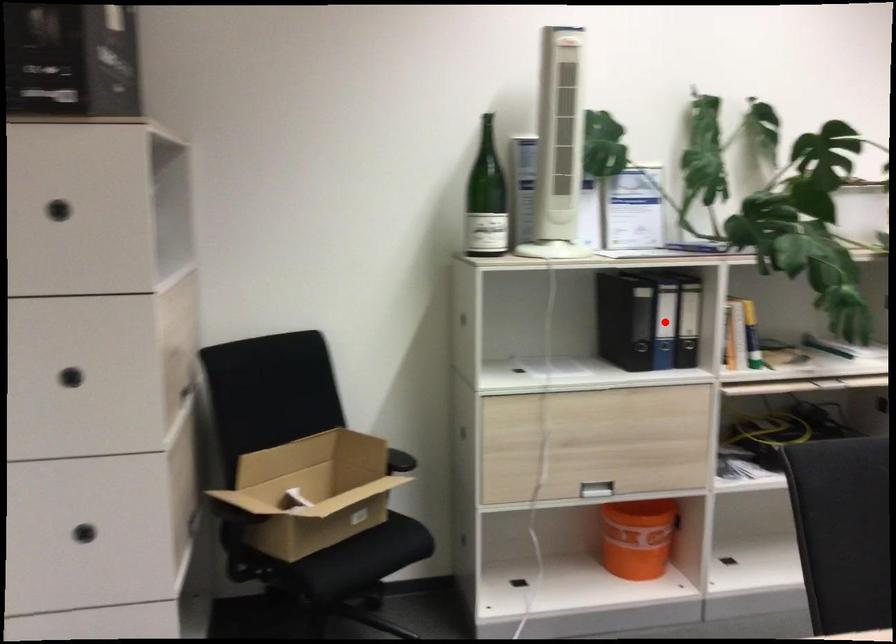
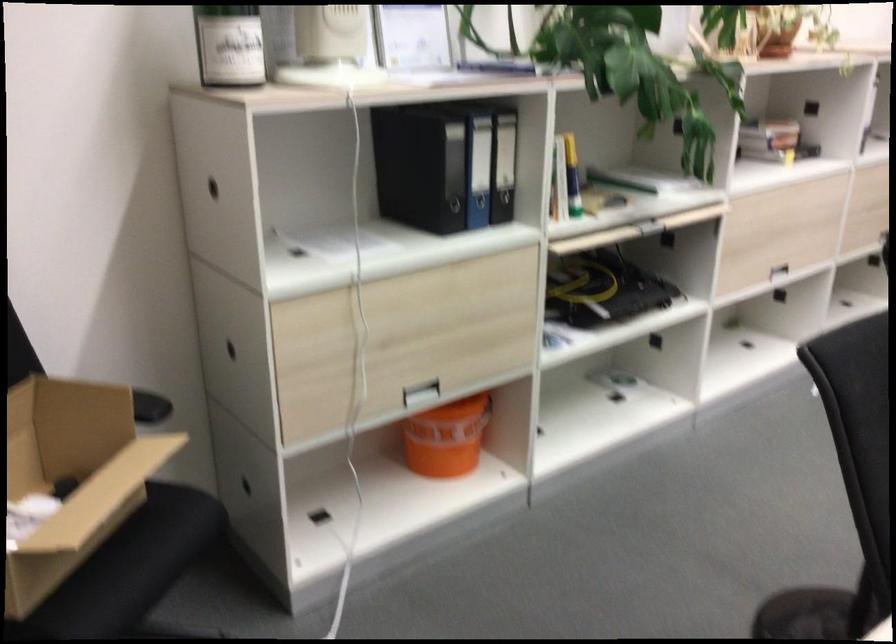
The point at the highlighted location is marked in the first image. Where is the corresponding point in the second image?

(478, 169)